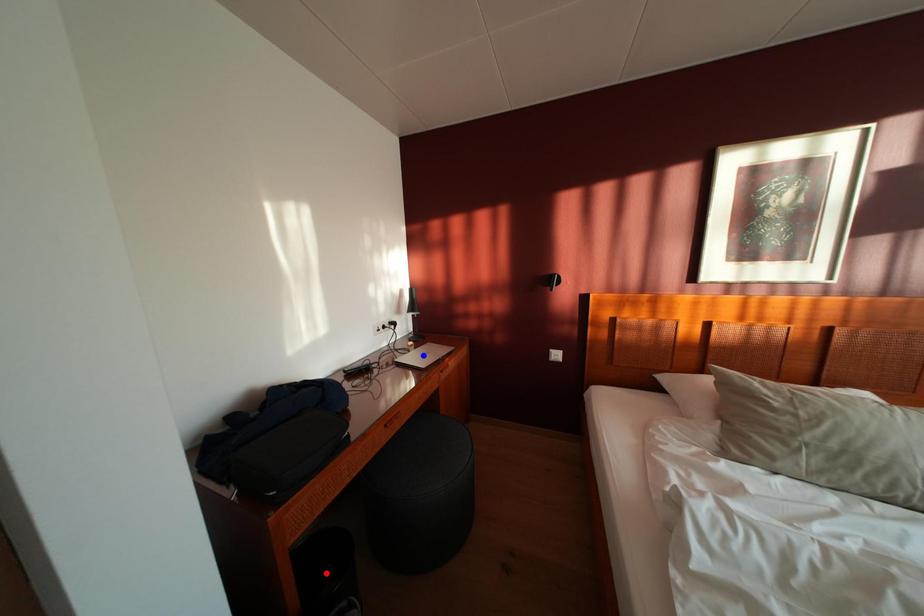
Question: In the image, two points are highlighted. Which point is nearer to the camera? Reply with the corresponding letter.

Choices:
 (A) blue point
 (B) red point

Answer: (B)